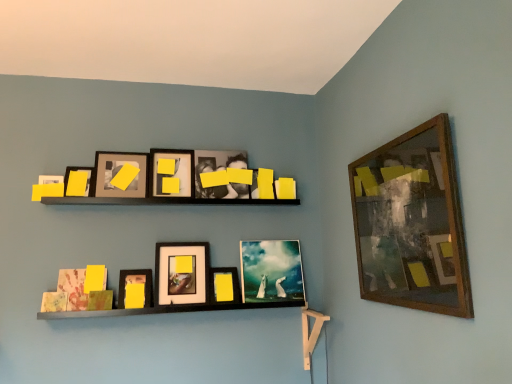
The height and width of the screenshot is (384, 512). I want to click on vacant area on top of wooden shelf at center (from a real-world perspective), so click(x=173, y=196).